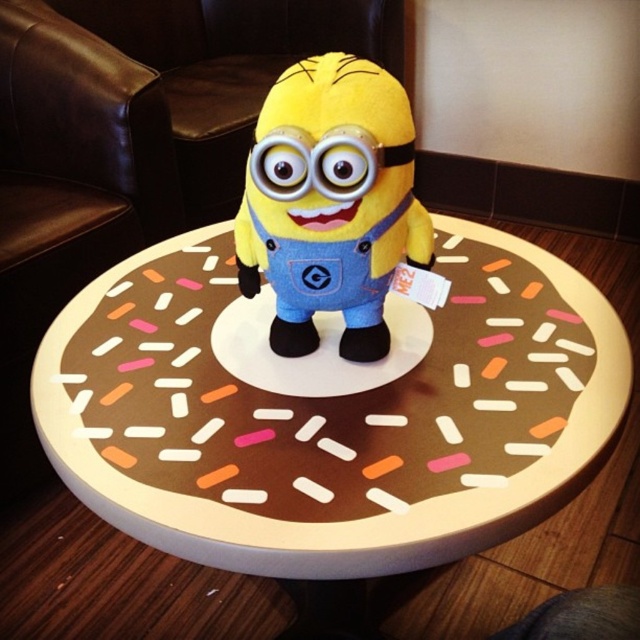
You are a customer at a cafe and see both the brownsprinkleddonut at center and the yellow plush toy at center on the same table. Which object takes up more horizontal space on the table?

The brownsprinkleddonut at center has a greater width than the yellow plush toy at center, so it occupies more horizontal space on the table.

You are a Minion standing on the circular table in the image. You want to reach the edge of the table to grab a sprinkle. Which direction should you move from your current position at the brownsprinkleddonut at center?

The brownsprinkleddonut at center is located at point (330, 410). Since the table is circular, moving towards the edge would require moving outward from the center. However, the coordinates suggest the donut is already near the center, so the Minion should move in any direction away from the center to reach the edge.

You are a customer in a cafe and you see a brownsprinkleddonut at center and a yellow plush toy at center on the table. Which item is closer to the edge of the table?

The brownsprinkleddonut at center is below the yellow plush toy at center, so the donut is closer to the edge of the table since it is positioned lower than the toy.